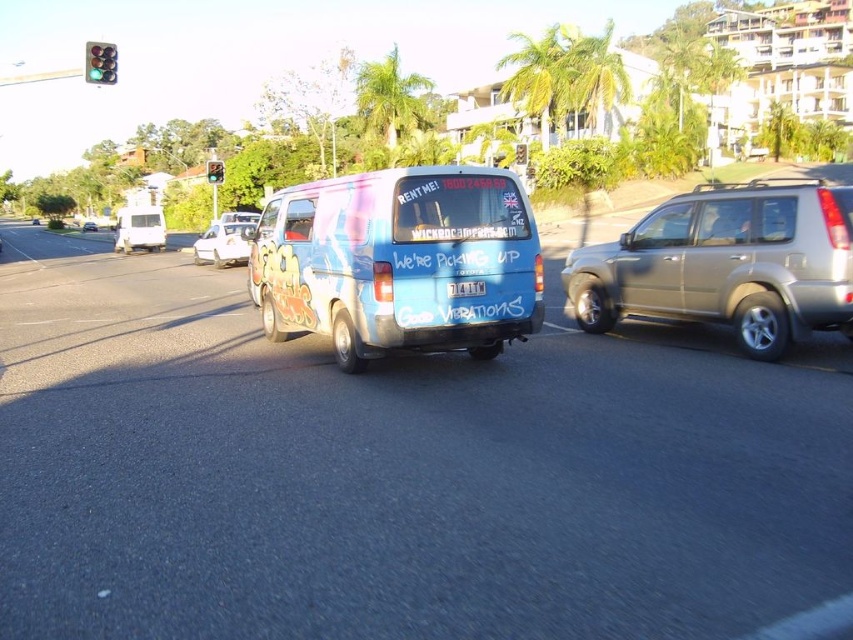
Question: Which object appears farthest from the camera in this image?

Choices:
 (A) white matte sedan at center
 (B) metallic silver suv at right
 (C) matte white van at center

Answer: (C)

Question: Is blue painted van at center in front of metallic silver suv at right?

Choices:
 (A) no
 (B) yes

Answer: (A)

Question: Based on their relative distances, which object is nearer to the white plastic license plate at rear?

Choices:
 (A) matte white van at center
 (B) green glass traffic light at upper left

Answer: (B)

Question: Among these points, which one is nearest to the camera?

Choices:
 (A) (311, 262)
 (B) (86, 54)
 (C) (90, 225)
 (D) (120, 225)

Answer: (A)

Question: Is white matte sedan at center thinner than green glass traffic light at upper left?

Choices:
 (A) yes
 (B) no

Answer: (A)

Question: Can you confirm if metallic silver suv at right is positioned below white matte van at left?

Choices:
 (A) no
 (B) yes

Answer: (B)